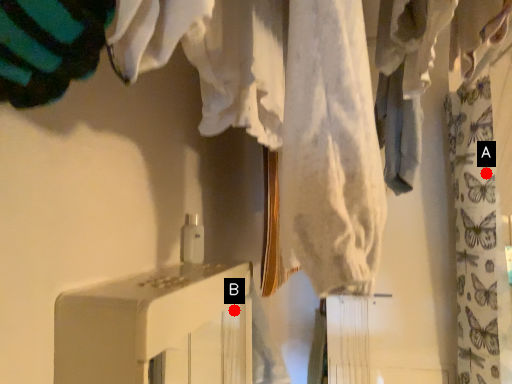
Question: Two points are circled on the image, labeled by A and B beside each circle. Among these points, which one is farthest from the camera?

Choices:
 (A) A is further
 (B) B is further

Answer: (A)